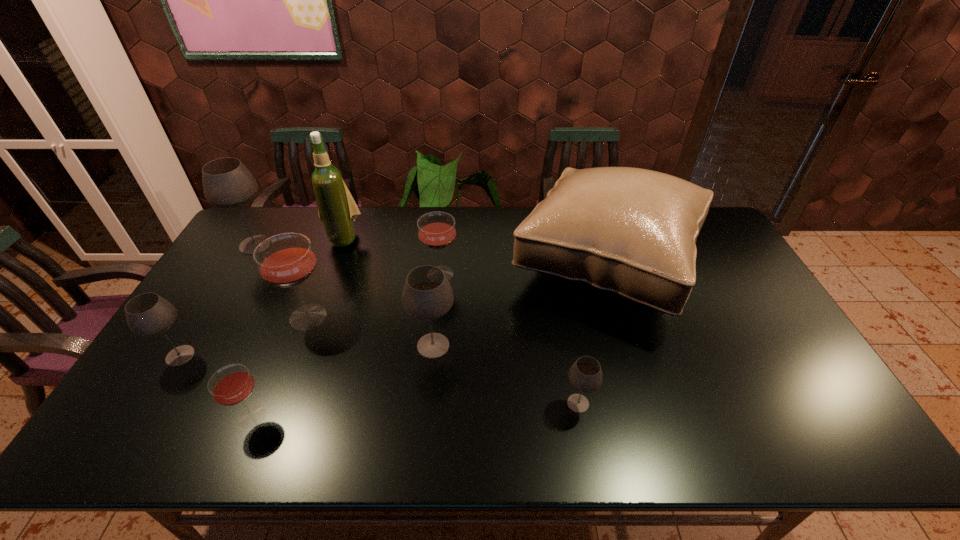
This screenshot has height=540, width=960. I want to click on the sixth closest object relative to the third gray wineglass from left to right, so click(x=337, y=210).

Point out which object is positioned as the nearest to the biggest gray wineglass. Please provide its 2D coordinates. Your answer should be formatted as a tuple, i.e. [(x, y)], where the tuple contains the x and y coordinates of a point satisfying the conditions above.

[(337, 210)]

The image size is (960, 540). I want to click on wineglass that is the third closest to the second gray wineglass from right to left, so click(x=585, y=375).

In order to click on wineglass that is the third closest to the cushion in this screenshot , I will do `click(436, 230)`.

Identify the location of gray wineglass that stands as the closest to the rightmost gray wineglass. This screenshot has height=540, width=960. (427, 294).

Identify which gray wineglass is located as the fourth nearest to the cushion. Please provide its 2D coordinates. Your answer should be formatted as a tuple, i.e. [(x, y)], where the tuple contains the x and y coordinates of a point satisfying the conditions above.

[(148, 314)]

Locate which red wineglass ranks second in proximity to the tallest wineglass. Please provide its 2D coordinates. Your answer should be formatted as a tuple, i.e. [(x, y)], where the tuple contains the x and y coordinates of a point satisfying the conditions above.

[(436, 230)]

Locate an element on the screen. The image size is (960, 540). the second closest red wineglass to the third smallest gray wineglass is located at coordinates (286, 260).

I want to click on free space in the image that satisfies the following two spatial constraints: 1. on the front side of the gray cushion; 2. on the left side of the farthest wineglass, so click(245, 263).

This screenshot has height=540, width=960. What are the coordinates of `free space that satisfies the following two spatial constraints: 1. on the front side of the tallest wineglass; 2. on the right side of the cushion` in the screenshot? It's located at (245, 263).